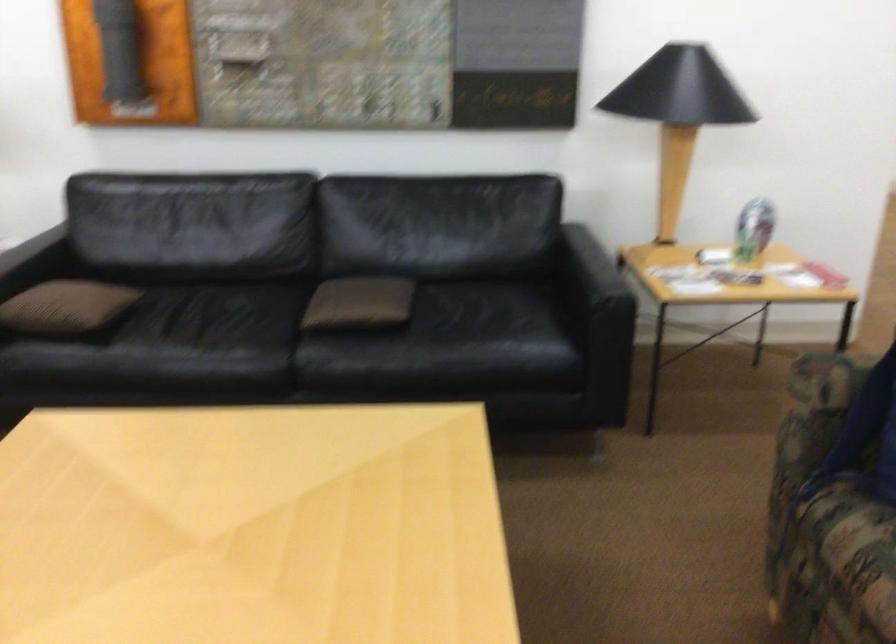
The height and width of the screenshot is (644, 896). What are the coordinates of `black sofa sitting surface` in the screenshot? It's located at (219, 336).